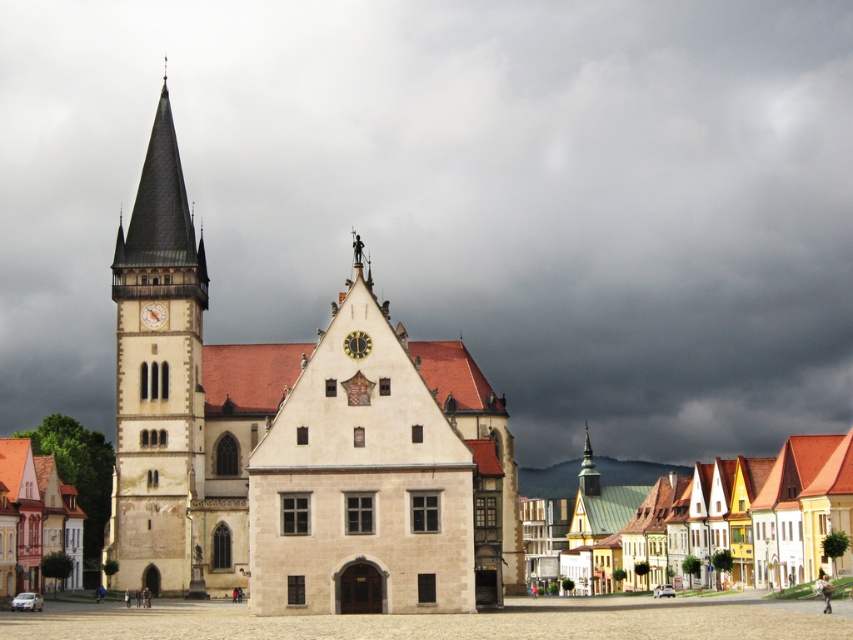
Can you confirm if beige stone church at center is taller than white stone tower at left?

In fact, beige stone church at center may be shorter than white stone tower at left.

Who is positioned more to the right, beige stone church at center or white stone tower at left?

Positioned to the right is beige stone church at center.

Is point (439, 512) positioned behind point (189, 268)?

No, (439, 512) is closer to viewer.

Image resolution: width=853 pixels, height=640 pixels. I want to click on beige stone church at center, so click(x=360, y=481).

Image resolution: width=853 pixels, height=640 pixels. Describe the element at coordinates (157, 378) in the screenshot. I see `white stone tower at left` at that location.

Can you confirm if white stone tower at left is smaller than white painted wooden houses at lower right?

Yes, white stone tower at left is smaller than white painted wooden houses at lower right.

Describe the element at coordinates (157, 378) in the screenshot. I see `white stone tower at left` at that location.

At what (x,y) coordinates should I click in order to perform the action: click on white stone tower at left. Please return your answer as a coordinate pair (x, y). Looking at the image, I should click on (157, 378).

Is point (184, 515) positioned behind point (358, 349)?

Yes.

The width and height of the screenshot is (853, 640). Describe the element at coordinates (157, 378) in the screenshot. I see `white stone tower at left` at that location.

Identify the location of white stone tower at left. (157, 378).